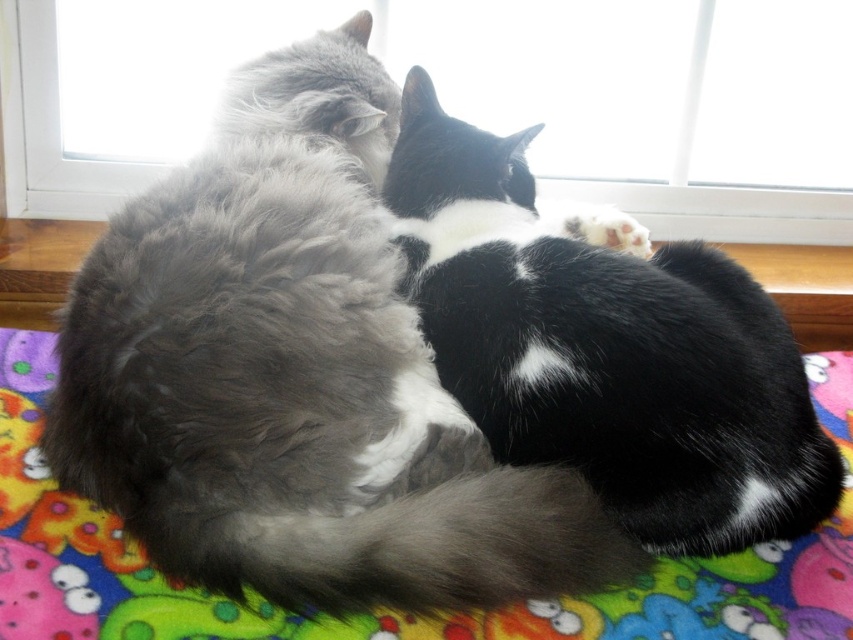
You are a cat owner who wants to move your cats from the multicolored fleece blanket at center to the wooden window sill at center. Based on the scene description, can you determine if the cats will be able to move directly to the window sill without needing to go around the blanket?

The multicolored fleece blanket at center is in front of the wooden window sill at center, so the cats would need to step over or move the blanket to reach the window sill directly. Since the blanket is in front, they can not go through it and would have to go around or move it.

You are observing two cats on a colorful blanket. The fluffy gray cat at center and the black and white fur cat at center are both lying down. Which cat is positioned to the left of the other?

The fluffy gray cat at center is to the left of the black and white fur cat at center.